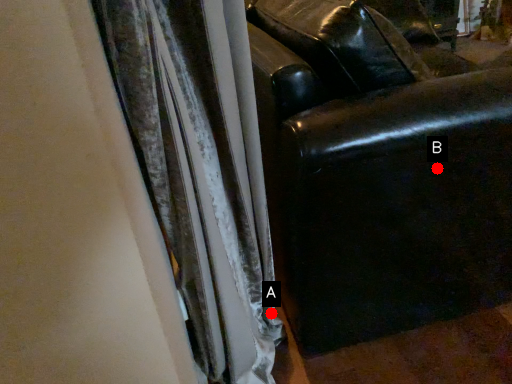
Question: Two points are circled on the image, labeled by A and B beside each circle. Among these points, which one is farthest from the camera?

Choices:
 (A) A is further
 (B) B is further

Answer: (A)